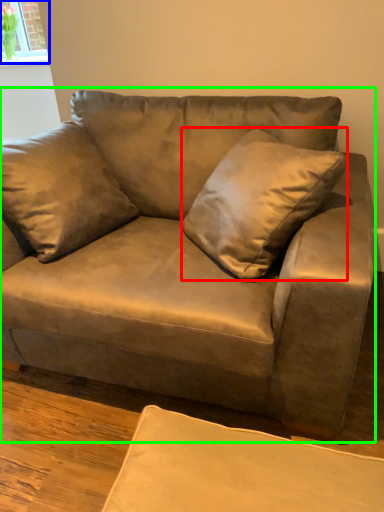
Question: Estimate the real-world distances between objects in this image. Which object is farther from throw pillow (highlighted by a red box), window (highlighted by a blue box) or studio couch (highlighted by a green box)?

Choices:
 (A) window
 (B) studio couch

Answer: (A)